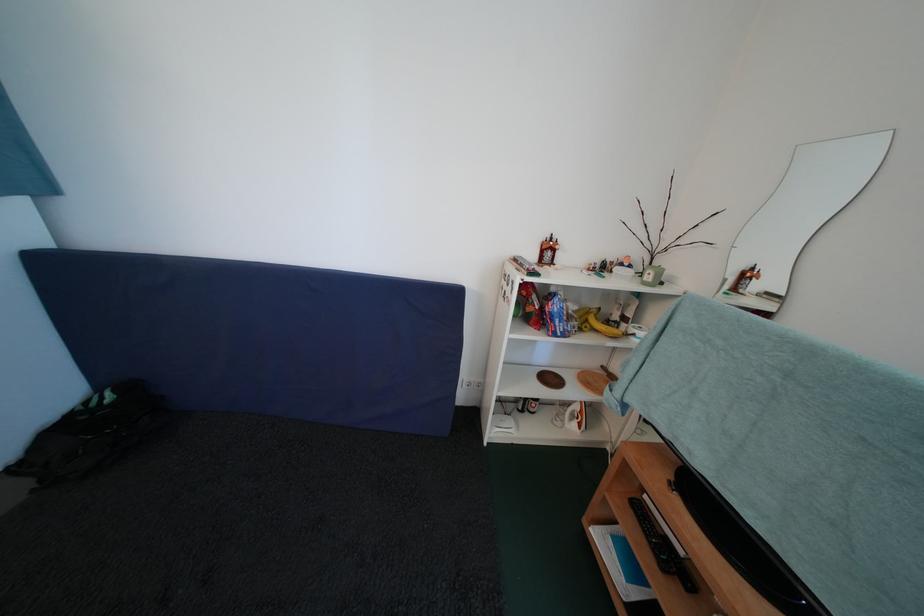
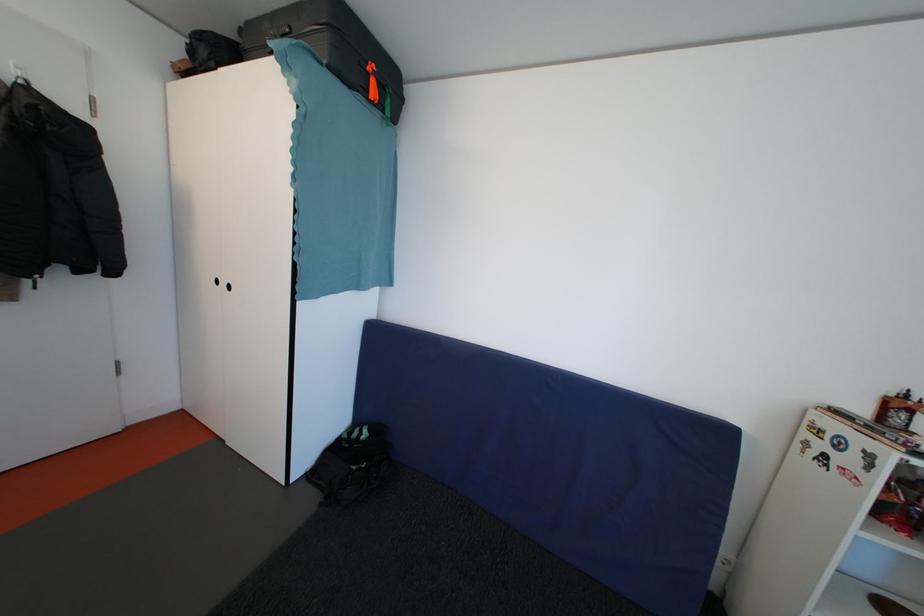
Question: The camera is either moving clockwise (left) or counter-clockwise (right) around the object. The first image is from the beginning of the video and the second image is from the end. Is the camera moving left or right when shooting the video?

Choices:
 (A) Left
 (B) Right

Answer: (B)